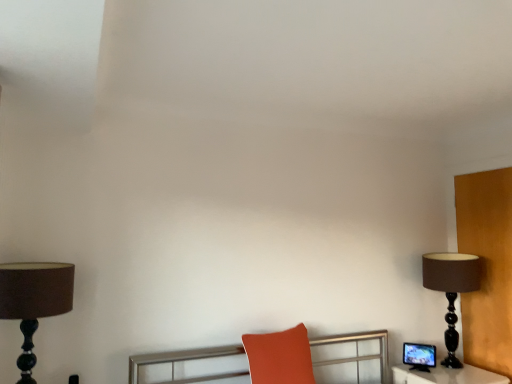
Question: Is matte orange cushion at center completely or partially inside brown matte lamp at right, placed as the 2th lamp when sorted from front to back?

Choices:
 (A) no
 (B) yes

Answer: (A)

Question: Can you confirm if brown matte lamp at right, the first lamp when ordered from right to left, is positioned to the right of matte orange cushion at center?

Choices:
 (A) no
 (B) yes

Answer: (B)

Question: From the image's perspective, is brown matte lamp at right, the first lamp when ordered from right to left, beneath matte orange cushion at center?

Choices:
 (A) yes
 (B) no

Answer: (B)

Question: Considering the relative sizes of brown matte lamp at right, placed as the 2th lamp when sorted from front to back, and matte orange cushion at center in the image provided, is brown matte lamp at right, placed as the 2th lamp when sorted from front to back, thinner than matte orange cushion at center?

Choices:
 (A) no
 (B) yes

Answer: (A)

Question: Is the surface of brown matte lamp at right, which appears as the second lamp when viewed from the left, in direct contact with matte orange cushion at center?

Choices:
 (A) yes
 (B) no

Answer: (B)

Question: From the image's perspective, is brown fabric lampshade at left, positioned as the 2th lamp in back-to-front order, above or below matte orange cushion at center?

Choices:
 (A) below
 (B) above

Answer: (B)

Question: Considering the positions of point (10, 317) and point (291, 342), is point (10, 317) closer or farther from the camera than point (291, 342)?

Choices:
 (A) farther
 (B) closer

Answer: (B)

Question: Is brown fabric lampshade at left, which ranks as the 2th lamp in right-to-left order, inside the boundaries of matte orange cushion at center, or outside?

Choices:
 (A) inside
 (B) outside

Answer: (B)

Question: Considering the relative positions of brown fabric lampshade at left, marked as the first lamp in a left-to-right arrangement, and matte orange cushion at center in the image provided, is brown fabric lampshade at left, marked as the first lamp in a left-to-right arrangement, to the left or to the right of matte orange cushion at center?

Choices:
 (A) right
 (B) left

Answer: (B)

Question: Do you think brown matte lamp at right, the first lamp when ordered from right to left, is within brown fabric lampshade at left, marked as the first lamp in a left-to-right arrangement, or outside of it?

Choices:
 (A) outside
 (B) inside

Answer: (A)

Question: Considering their positions, is brown matte lamp at right, which ranks as the 1th lamp in back-to-front order, located in front of or behind brown fabric lampshade at left, which ranks as the 2th lamp in right-to-left order?

Choices:
 (A) behind
 (B) front

Answer: (A)

Question: In terms of size, does brown matte lamp at right, which ranks as the 1th lamp in back-to-front order, appear bigger or smaller than brown fabric lampshade at left, which ranks as the 2th lamp in right-to-left order?

Choices:
 (A) big
 (B) small

Answer: (A)

Question: From a real-world perspective, is brown matte lamp at right, which appears as the second lamp when viewed from the left, positioned above or below brown fabric lampshade at left, positioned as the 2th lamp in back-to-front order?

Choices:
 (A) above
 (B) below

Answer: (B)

Question: In the image, is matte orange cushion at center positioned in front of or behind matte black monitor at right?

Choices:
 (A) front
 (B) behind

Answer: (A)

Question: Choose the correct answer: Is matte orange cushion at center inside matte black monitor at right or outside it?

Choices:
 (A) inside
 (B) outside

Answer: (B)